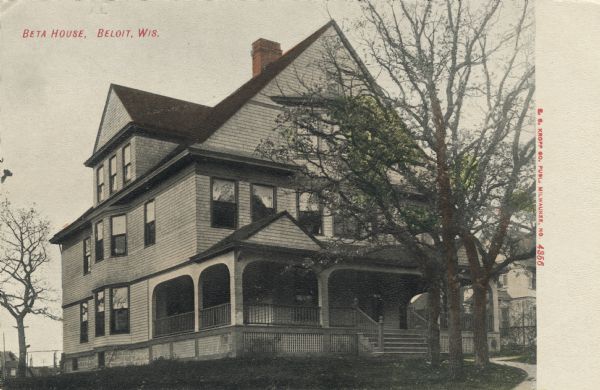
The image size is (600, 390). Find the location of `window`. window is located at coordinates (103, 232).